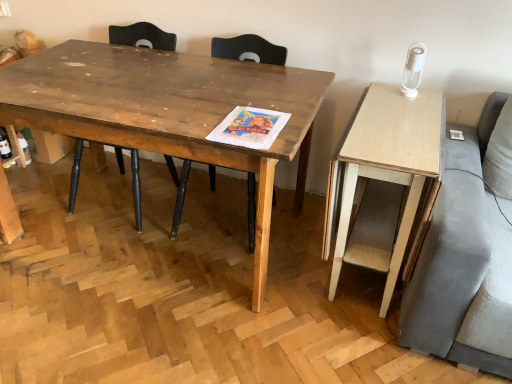
Image resolution: width=512 pixels, height=384 pixels. I want to click on free space to the left of light wood desk at right, so click(x=265, y=283).